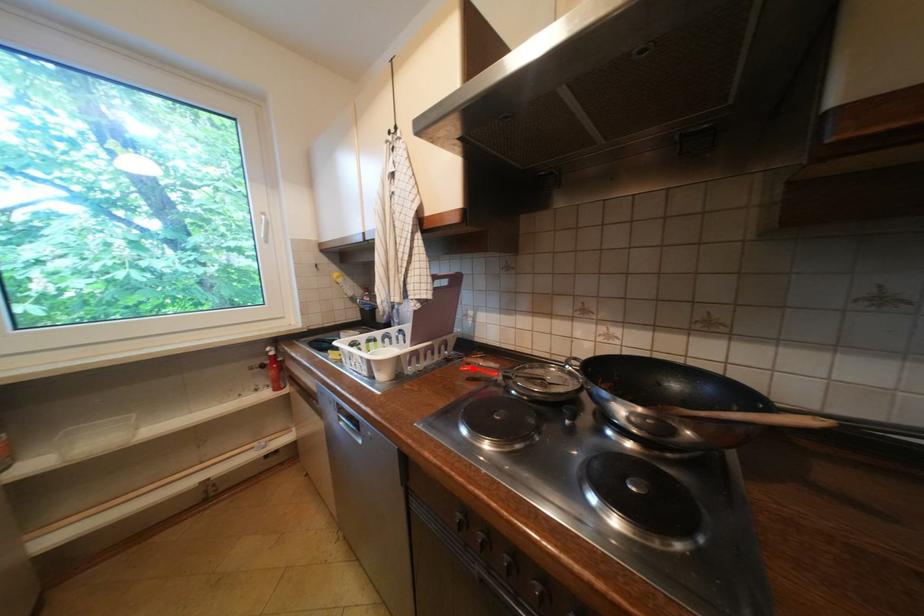
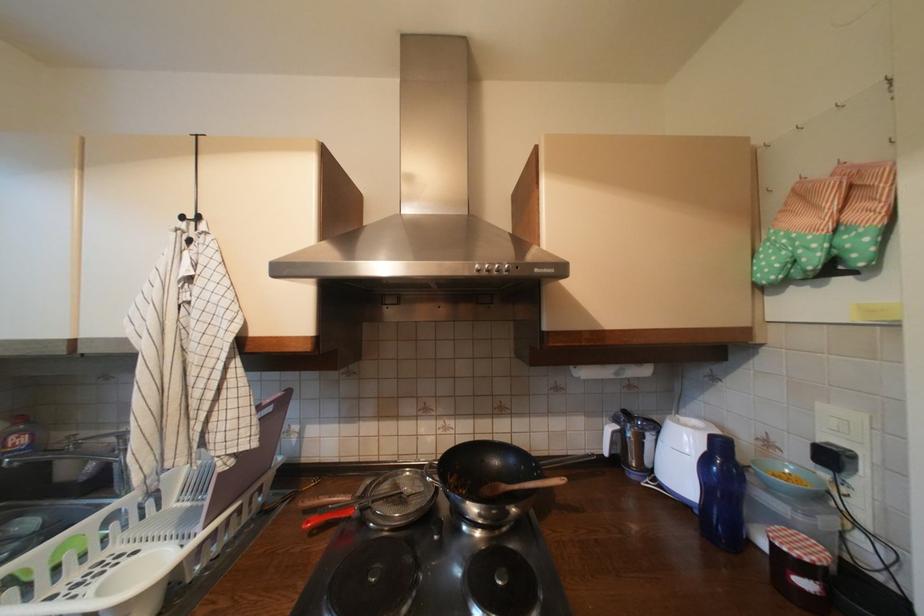
Find the pixel in the second image that matches the highlighted location in the first image.

(317, 524)